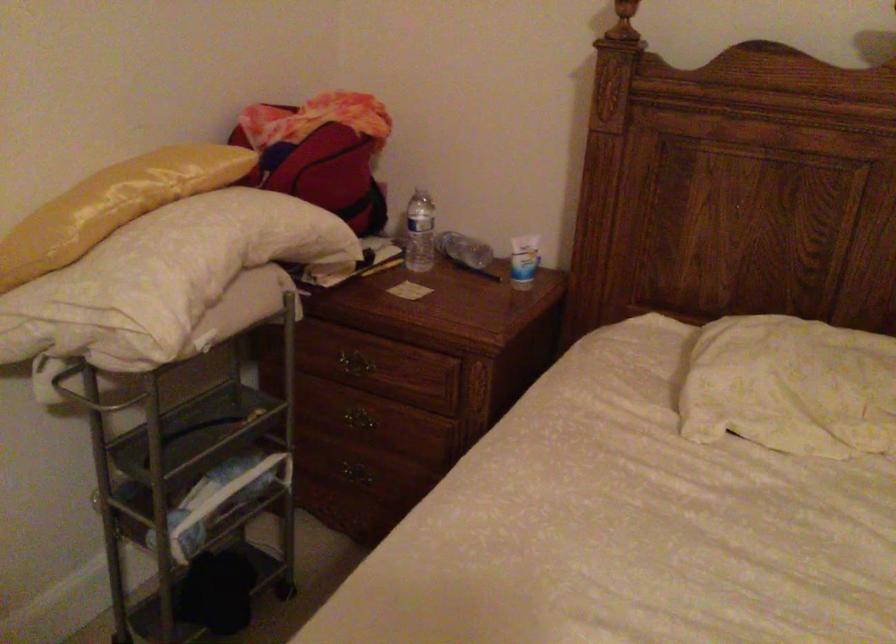
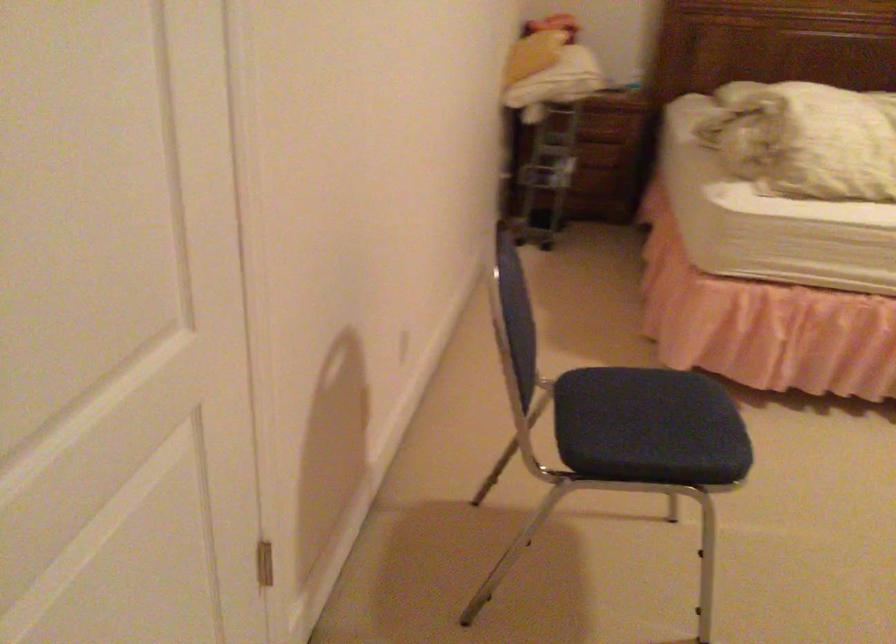
The images are taken continuously from a first-person perspective. In which direction are you moving?

The movement direction of the cameraman is left, backward.